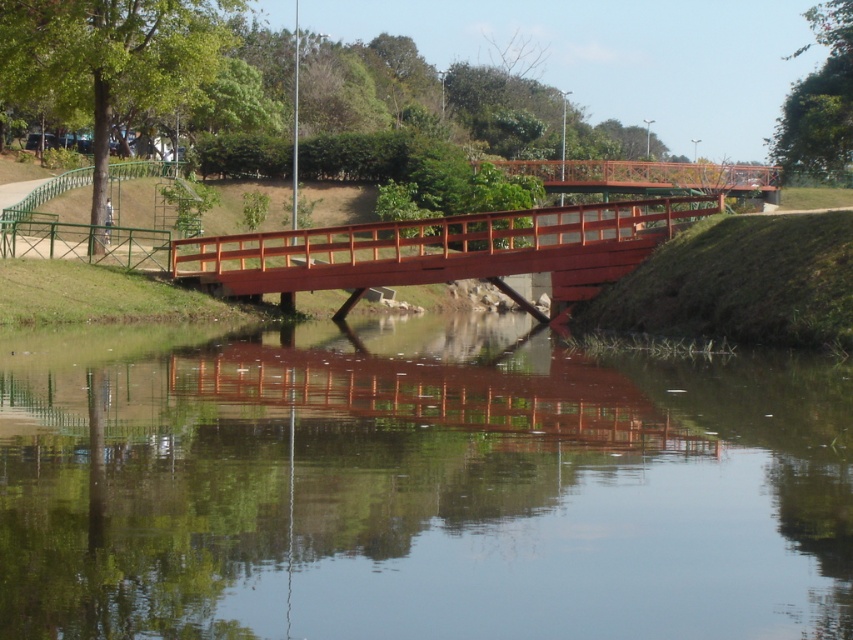
Who is shorter, smooth brown water at center or smooth wooden bridge at center?

smooth brown water at center is shorter.

Based on the photo, between smooth brown water at center and smooth wooden bridge at center, which one is positioned lower?

smooth brown water at center is below.

You are a GUI agent. You are given a task and a screenshot of the screen. Output one action in this format:
    pyautogui.click(x=<x>, y=<y>)
    Task: Click on the smooth brown water at center
    
    Given the screenshot: What is the action you would take?
    (419, 490)

Is smooth wooden bridge at center shorter than rustic wood bridge at center?

Yes.

Is point (315, 289) closer to camera compared to point (595, 168)?

Yes.

Identify the location of smooth wooden bridge at center. The width and height of the screenshot is (853, 640). (442, 250).

Find the location of a particular element. The height and width of the screenshot is (640, 853). smooth wooden bridge at center is located at coordinates (442, 250).

You are a GUI agent. You are given a task and a screenshot of the screen. Output one action in this format:
    pyautogui.click(x=<x>, y=<y>)
    Task: Click on the smooth brown water at center
    The width and height of the screenshot is (853, 640).
    Given the screenshot: What is the action you would take?
    pyautogui.click(x=419, y=490)

The height and width of the screenshot is (640, 853). Find the location of `smooth brown water at center`. smooth brown water at center is located at coordinates (419, 490).

I want to click on smooth brown water at center, so click(419, 490).